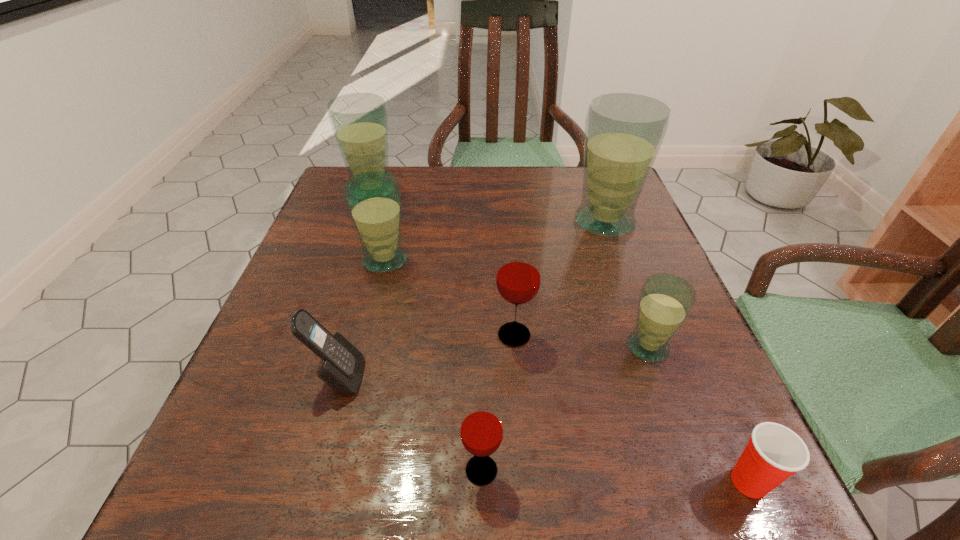
Locate an element on the screen. The width and height of the screenshot is (960, 540). free location located on the back of the Dixie cup is located at coordinates coord(679,323).

You are a GUI agent. You are given a task and a screenshot of the screen. Output one action in this format:
    pyautogui.click(x=<x>, y=<y>)
    Task: Click on the glass that is at the near edge
    The width and height of the screenshot is (960, 540).
    Given the screenshot: What is the action you would take?
    pyautogui.click(x=481, y=430)

Find the location of a particular element. The image size is (960, 540). Dixie cup at the near edge is located at coordinates (774, 452).

Find the location of `cellular telephone that is positioned at the left edge`. cellular telephone that is positioned at the left edge is located at coordinates (341, 367).

Identify the location of Dixie cup that is positioned at the right edge. The height and width of the screenshot is (540, 960). (774, 452).

I want to click on object present at the far left corner, so click(x=359, y=121).

Locate an element on the screen. The height and width of the screenshot is (540, 960). object that is at the far right corner is located at coordinates (623, 131).

Locate an element on the screen. The width and height of the screenshot is (960, 540). object positioned at the near right corner is located at coordinates (774, 452).

This screenshot has width=960, height=540. In the image, there is a desktop. Find the location of `vacant space at the far edge`. vacant space at the far edge is located at coordinates (477, 168).

This screenshot has width=960, height=540. What are the coordinates of `free space at the near edge of the desktop` in the screenshot? It's located at (459, 494).